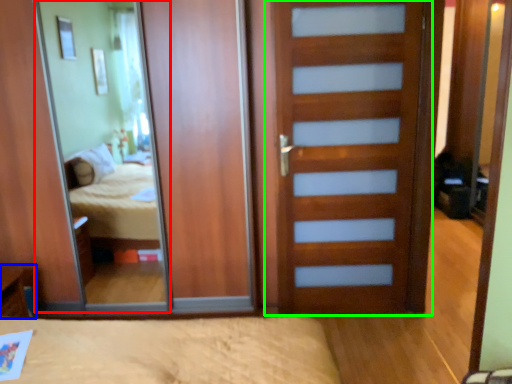
Question: Based on their relative distances, which object is nearer to mirror (highlighted by a red box)? Choose from table (highlighted by a blue box) and door (highlighted by a green box).

Choices:
 (A) table
 (B) door

Answer: (A)